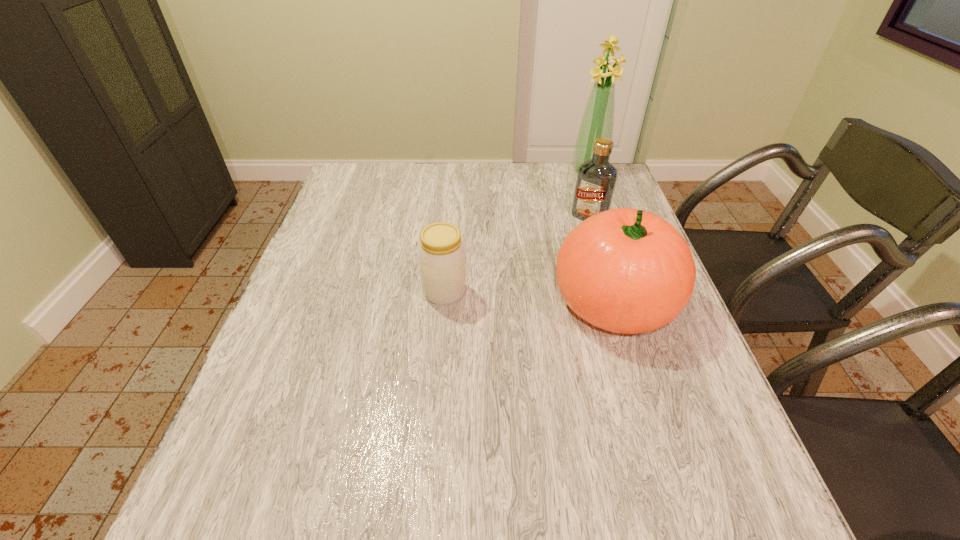
You are a GUI agent. You are given a task and a screenshot of the screen. Output one action in this format:
    pyautogui.click(x=<x>, y=<y>)
    Task: Click on the free space on the desktop that is between the leftmost object and the pumpkin and is positioned on the front-facing side of the third nearest object
    This screenshot has height=540, width=960.
    Given the screenshot: What is the action you would take?
    pyautogui.click(x=524, y=296)

Find the location of a particular element. free spot on the desktop that is between the shortest object and the pumpkin and is positioned on the front-facing side of the bouquet is located at coordinates (515, 296).